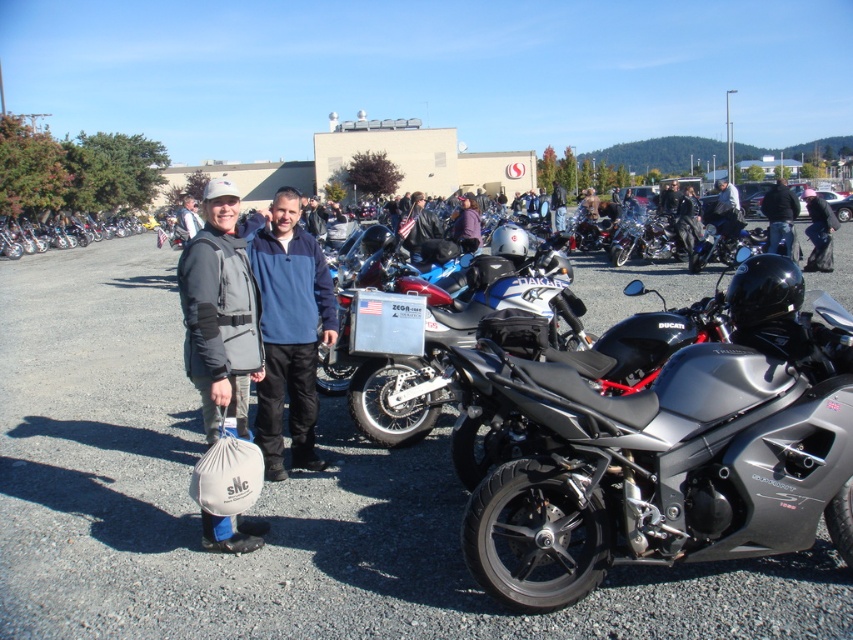
In the scene shown: Between metallic gray motorcycle at center and navy blue fleece at center, which one appears on the left side from the viewer's perspective?

From the viewer's perspective, navy blue fleece at center appears more on the left side.

This screenshot has width=853, height=640. What are the coordinates of `metallic gray motorcycle at center` in the screenshot? It's located at (650, 465).

Does gray fabric jacket at center lie behind navy blue fleece at center?

That is False.

From the picture: Does gray fabric jacket at center have a greater width compared to navy blue fleece at center?

Correct, the width of gray fabric jacket at center exceeds that of navy blue fleece at center.

Who is more distant from viewer, (259, 380) or (308, 413)?

Point (308, 413)

This screenshot has height=640, width=853. Find the location of `gray fabric jacket at center`. gray fabric jacket at center is located at coordinates (219, 312).

Consider the image. Is metallic silver motorcycle at center thinner than metallic gray motorcycle at center?

No.

Between point (332, 589) and point (776, 429), which one is positioned in front?

Point (776, 429)

This screenshot has height=640, width=853. What do you see at coordinates (273, 502) in the screenshot? I see `metallic silver motorcycle at center` at bounding box center [273, 502].

Find the location of `metallic silver motorcycle at center`. metallic silver motorcycle at center is located at coordinates (273, 502).